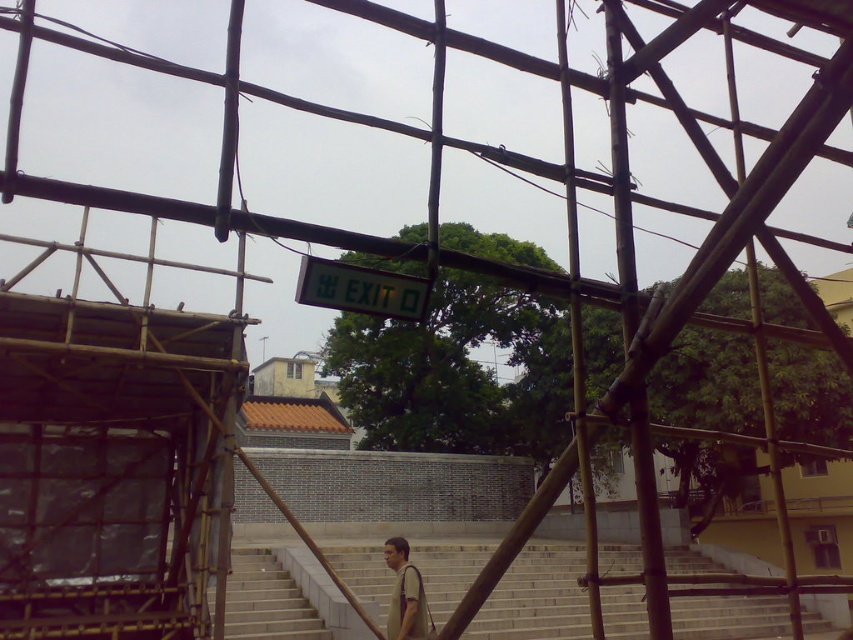
Question: Is light gray concrete stairs at center smaller than light brown fabric shirt at center?

Choices:
 (A) yes
 (B) no

Answer: (B)

Question: Which point is farther to the camera?

Choices:
 (A) (231, 582)
 (B) (407, 586)

Answer: (A)

Question: Can you confirm if light gray concrete stairs at center is bigger than light brown fabric shirt at center?

Choices:
 (A) yes
 (B) no

Answer: (A)

Question: Is light gray concrete stairs at center smaller than light brown fabric shirt at center?

Choices:
 (A) no
 (B) yes

Answer: (A)